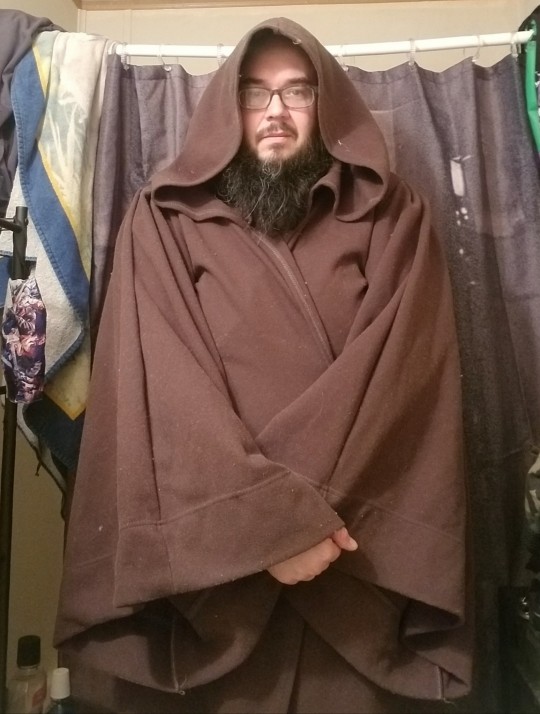
You are a GUI agent. You are given a task and a screenshot of the screen. Output one action in this format:
    pyautogui.click(x=<x>, y=<y>)
    Task: Click on the curtain rod
    The image size is (540, 714).
    Given the screenshot: What is the action you would take?
    pyautogui.click(x=367, y=46)